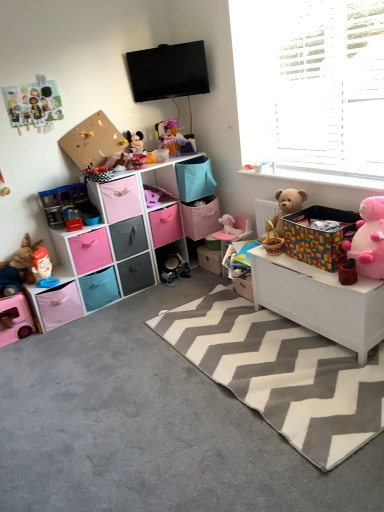
Question: Considering the relative positions of pink plush teddy bear at right, which is counted as the 2th teddy bear, starting from the back, and pink fabric drawer at lower left, positioned as the 6th drawer in top-to-bottom order, in the image provided, is pink plush teddy bear at right, which is counted as the 2th teddy bear, starting from the back, to the left of pink fabric drawer at lower left, positioned as the 6th drawer in top-to-bottom order, from the viewer's perspective?

Choices:
 (A) yes
 (B) no

Answer: (B)

Question: Does pink plush teddy bear at right, which is counted as the second teddy bear, starting from the left, have a larger size compared to pink fabric drawer at lower left, the 1th drawer positioned from the bottom?

Choices:
 (A) yes
 (B) no

Answer: (A)

Question: From the image's perspective, is pink plush teddy bear at right, which is counted as the 2th teddy bear, starting from the back, on top of pink fabric drawer at lower left, the 1th drawer positioned from the bottom?

Choices:
 (A) no
 (B) yes

Answer: (B)

Question: From a real-world perspective, is pink plush teddy bear at right, which is the first teddy bear from right to left, over pink fabric drawer at lower left, the 1th drawer positioned from the bottom?

Choices:
 (A) no
 (B) yes

Answer: (B)

Question: Does pink plush teddy bear at right, the 1th teddy bear in the front-to-back sequence, touch pink fabric drawer at lower left, the 1th drawer positioned from the bottom?

Choices:
 (A) yes
 (B) no

Answer: (B)

Question: Is pink plush teddy bear at right, the 1th teddy bear in the front-to-back sequence, at the right side of pink fabric drawer at lower left, positioned as the 6th drawer in top-to-bottom order?

Choices:
 (A) yes
 (B) no

Answer: (A)

Question: Is pink plastic toy car at lower left, the seventh toy positioned from the right, at the back of matte plastic mickey mouse at center, the fifth toy viewed from the left?

Choices:
 (A) no
 (B) yes

Answer: (A)

Question: Is pink plastic toy car at lower left, positioned as the 1th toy in left-to-right order, inside matte plastic mickey mouse at center, arranged as the third toy when viewed from the right?

Choices:
 (A) no
 (B) yes

Answer: (A)

Question: Is matte plastic mickey mouse at center, the fifth toy viewed from the left, to the right of pink plastic toy car at lower left, the seventh toy positioned from the right, from the viewer's perspective?

Choices:
 (A) no
 (B) yes

Answer: (B)

Question: From the image's perspective, is matte plastic mickey mouse at center, arranged as the third toy when viewed from the right, below pink plastic toy car at lower left, positioned as the 1th toy in left-to-right order?

Choices:
 (A) yes
 (B) no

Answer: (B)

Question: Is matte plastic mickey mouse at center, arranged as the third toy when viewed from the right, facing towards pink plastic toy car at lower left, the seventh toy positioned from the right?

Choices:
 (A) yes
 (B) no

Answer: (B)

Question: Is matte plastic mickey mouse at center, the fifth toy viewed from the left, taller than pink plastic toy car at lower left, positioned as the 1th toy in left-to-right order?

Choices:
 (A) no
 (B) yes

Answer: (A)

Question: Is gray carpet at lower left positioned beyond the bounds of gray chevron rug at center?

Choices:
 (A) yes
 (B) no

Answer: (A)